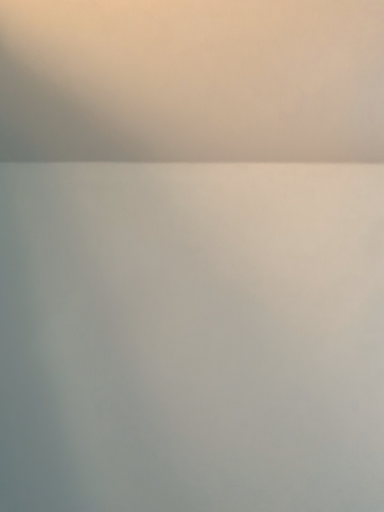
Question: Should I look upward or downward to see matte gray cloud at upper center?

Choices:
 (A) up
 (B) down

Answer: (A)